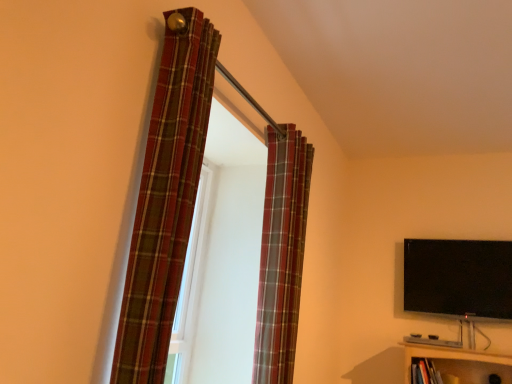
Question: From the image's perspective, is plaid fabric curtain at upper center, the 1th curtain in the right-to-left sequence, located beneath plaid fabric curtain at left, the 1th curtain in the front-to-back sequence?

Choices:
 (A) yes
 (B) no

Answer: (A)

Question: From a real-world perspective, does plaid fabric curtain at upper center, the 2th curtain viewed from the front, stand above plaid fabric curtain at left, the 1th curtain in the front-to-back sequence?

Choices:
 (A) yes
 (B) no

Answer: (B)

Question: Is plaid fabric curtain at upper center, the first curtain viewed from the back, smaller than plaid fabric curtain at left, placed as the 2th curtain when sorted from right to left?

Choices:
 (A) no
 (B) yes

Answer: (A)

Question: Considering the relative positions of plaid fabric curtain at upper center, the first curtain viewed from the back, and plaid fabric curtain at left, the 1th curtain in the front-to-back sequence, in the image provided, is plaid fabric curtain at upper center, the first curtain viewed from the back, in front of plaid fabric curtain at left, the 1th curtain in the front-to-back sequence,?

Choices:
 (A) yes
 (B) no

Answer: (B)

Question: Is plaid fabric curtain at upper center, the 1th curtain in the right-to-left sequence, positioned behind plaid fabric curtain at left, placed as the 2th curtain when sorted from right to left?

Choices:
 (A) yes
 (B) no

Answer: (A)

Question: Would you say plaid fabric curtain at upper center, which is the second curtain from left to right, is outside plaid fabric curtain at left, the 1th curtain in the front-to-back sequence?

Choices:
 (A) yes
 (B) no

Answer: (A)

Question: Can you confirm if plaid fabric curtain at upper center, the first curtain viewed from the back, is shorter than black glossy flat-screen tv at upper right?

Choices:
 (A) no
 (B) yes

Answer: (A)

Question: Considering the relative sizes of plaid fabric curtain at upper center, the 1th curtain in the right-to-left sequence, and black glossy flat-screen tv at upper right in the image provided, is plaid fabric curtain at upper center, the 1th curtain in the right-to-left sequence, thinner than black glossy flat-screen tv at upper right?

Choices:
 (A) yes
 (B) no

Answer: (B)

Question: From the image's perspective, is plaid fabric curtain at upper center, the first curtain viewed from the back, located above black glossy flat-screen tv at upper right?

Choices:
 (A) no
 (B) yes

Answer: (B)

Question: Is plaid fabric curtain at upper center, the 2th curtain viewed from the front, in front of black glossy flat-screen tv at upper right?

Choices:
 (A) yes
 (B) no

Answer: (A)

Question: Considering the relative positions of plaid fabric curtain at upper center, the 2th curtain viewed from the front, and black glossy flat-screen tv at upper right in the image provided, is plaid fabric curtain at upper center, the 2th curtain viewed from the front, to the right of black glossy flat-screen tv at upper right from the viewer's perspective?

Choices:
 (A) no
 (B) yes

Answer: (A)

Question: Considering the relative sizes of plaid fabric curtain at upper center, which is the second curtain from left to right, and black glossy flat-screen tv at upper right in the image provided, is plaid fabric curtain at upper center, which is the second curtain from left to right, smaller than black glossy flat-screen tv at upper right?

Choices:
 (A) no
 (B) yes

Answer: (A)

Question: Can you confirm if black glossy flat-screen tv at upper right is shorter than plaid fabric curtain at upper center, which is the second curtain from left to right?

Choices:
 (A) yes
 (B) no

Answer: (A)